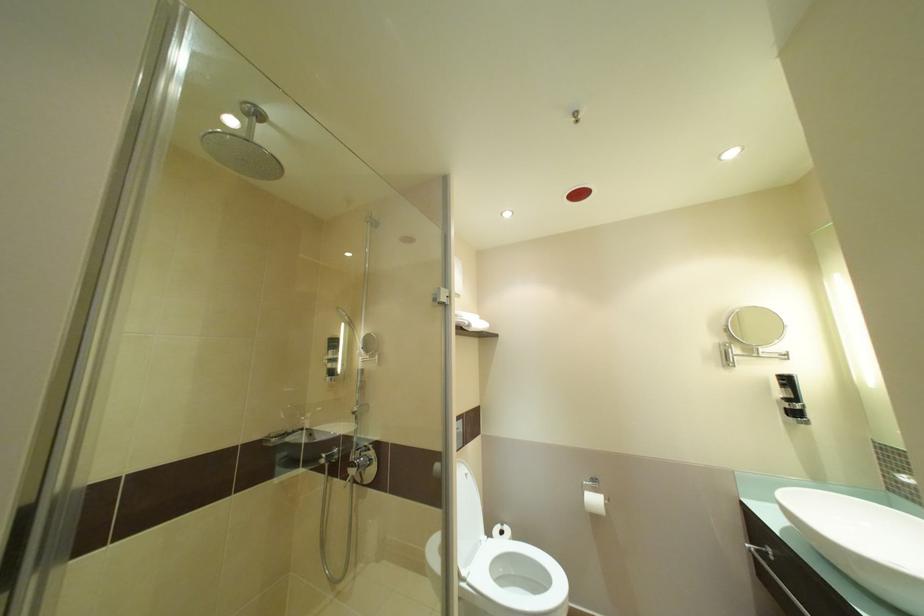
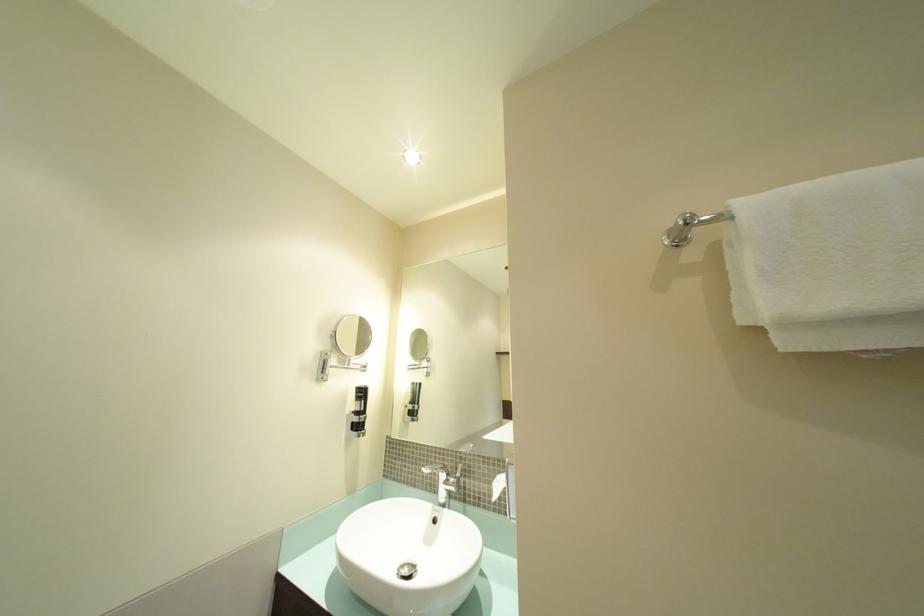
Question: The camera is either moving clockwise (left) or counter-clockwise (right) around the object. The first image is from the beginning of the video and the second image is from the end. Is the camera moving left or right when shooting the video?

Choices:
 (A) Left
 (B) Right

Answer: (A)